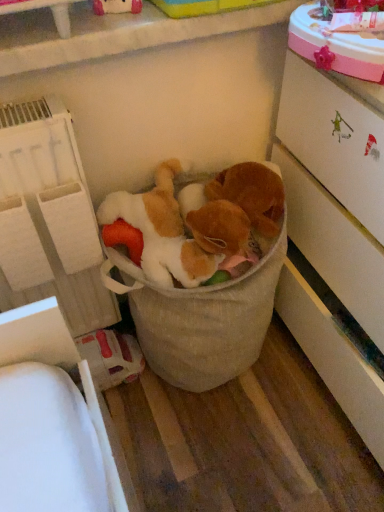
Where is `fluffy beige stuffed animals at center`? fluffy beige stuffed animals at center is located at coordinates (201, 318).

Is white textured shelf at left a part of fluffy beige stuffed animals at center?

No, white textured shelf at left is not a part of fluffy beige stuffed animals at center.

How different are the orientations of fluffy beige stuffed animals at center and white textured shelf at left in degrees?

fluffy beige stuffed animals at center and white textured shelf at left are facing 1.89 degrees away from each other.

Looking at this image, from a real-world perspective, is fluffy beige stuffed animals at center positioned under white textured shelf at left based on gravity?

Indeed, from a real-world perspective, fluffy beige stuffed animals at center is positioned beneath white textured shelf at left.

How different are the orientations of white textured shelf at left and fluffy beige stuffed animals at center in degrees?

white textured shelf at left and fluffy beige stuffed animals at center are facing 1.89 degrees away from each other.

Considering the sizes of objects white textured shelf at left and fluffy beige stuffed animals at center in the image provided, who is wider, white textured shelf at left or fluffy beige stuffed animals at center?

fluffy beige stuffed animals at center.

From the image's perspective, is white textured shelf at left above or below fluffy beige stuffed animals at center?

Clearly, from the image's perspective, white textured shelf at left is above fluffy beige stuffed animals at center.

Image resolution: width=384 pixels, height=512 pixels. Find the location of `shelf above the fluffy beige stuffed animals at center (from a real-world perspective)`. shelf above the fluffy beige stuffed animals at center (from a real-world perspective) is located at coordinates (x=49, y=218).

From the image's perspective, does white glossy cabinet at right appear lower than white textured shelf at left?

Actually, white glossy cabinet at right appears above white textured shelf at left in the image.

Is white glossy cabinet at right beside white textured shelf at left?

No, white glossy cabinet at right is not touching white textured shelf at left.

Looking at this image, which object is wider, white glossy cabinet at right or white textured shelf at left?

Wider between the two is white glossy cabinet at right.

From a real-world perspective, who is located higher, white glossy cabinet at right or white textured shelf at left?

From a 3D spatial view, white textured shelf at left is above.

Measure the distance from fluffy beige stuffed animals at center to white glossy cabinet at right.

They are 9.50 inches apart.

Is fluffy beige stuffed animals at center taller than white glossy cabinet at right?

Incorrect, the height of fluffy beige stuffed animals at center is not larger of that of white glossy cabinet at right.

Can you confirm if fluffy beige stuffed animals at center is positioned to the right of white glossy cabinet at right?

Incorrect, fluffy beige stuffed animals at center is not on the right side of white glossy cabinet at right.

Is white glossy cabinet at right surrounded by fluffy beige stuffed animals at center?

That's incorrect, white glossy cabinet at right is not inside fluffy beige stuffed animals at center.

Is point (75, 223) closer or farther from the camera than point (320, 139)?

Point (75, 223).

Are white textured shelf at left and white glossy cabinet at right located far from each other?

No, white textured shelf at left is not far away from white glossy cabinet at right.

Is white textured shelf at left looking in the opposite direction of white glossy cabinet at right?

No, white textured shelf at left's orientation is not away from white glossy cabinet at right.

How different are the orientations of white glossy cabinet at right and fluffy beige stuffed animals at center in degrees?

89.4 degrees separate the facing orientations of white glossy cabinet at right and fluffy beige stuffed animals at center.

From the image's perspective, which is above, white glossy cabinet at right or fluffy beige stuffed animals at center?

white glossy cabinet at right.

Is white glossy cabinet at right at the left side of fluffy beige stuffed animals at center?

In fact, white glossy cabinet at right is to the right of fluffy beige stuffed animals at center.

From a real-world perspective, does white glossy cabinet at right sit lower than fluffy beige stuffed animals at center?

Incorrect, from a real-world perspective, white glossy cabinet at right is higher than fluffy beige stuffed animals at center.

Identify the location of toy below the white textured shelf at left (from the image's perspective). (201, 318).

Locate an element on the screen. The image size is (384, 512). shelf that appears above the fluffy beige stuffed animals at center (from the image's perspective) is located at coordinates (49, 218).

From the image, which object appears to be nearer to fluffy beige stuffed animals at center, white glossy cabinet at right or white textured shelf at left?

white textured shelf at left is positioned closer to the anchor fluffy beige stuffed animals at center.

Estimate the real-world distances between objects in this image. Which object is closer to white textured shelf at left, fluffy beige stuffed animals at center or white glossy cabinet at right?

fluffy beige stuffed animals at center is positioned closer to the anchor white textured shelf at left.

Estimate the real-world distances between objects in this image. Which object is further from fluffy beige stuffed animals at center, white textured shelf at left or white glossy cabinet at right?

white glossy cabinet at right is positioned further to the anchor fluffy beige stuffed animals at center.

Considering their positions, is white textured shelf at left positioned further to white glossy cabinet at right than fluffy beige stuffed animals at center?

white textured shelf at left lies further to white glossy cabinet at right than the other object.

Considering their positions, is white glossy cabinet at right positioned closer to white textured shelf at left than fluffy beige stuffed animals at center?

Among the two, fluffy beige stuffed animals at center is located nearer to white textured shelf at left.

Which object lies further to the anchor point white glossy cabinet at right, fluffy beige stuffed animals at center or white textured shelf at left?

Among the two, white textured shelf at left is located further to white glossy cabinet at right.

Where is `toy between white textured shelf at left and white glossy cabinet at right`? toy between white textured shelf at left and white glossy cabinet at right is located at coordinates [x=201, y=318].